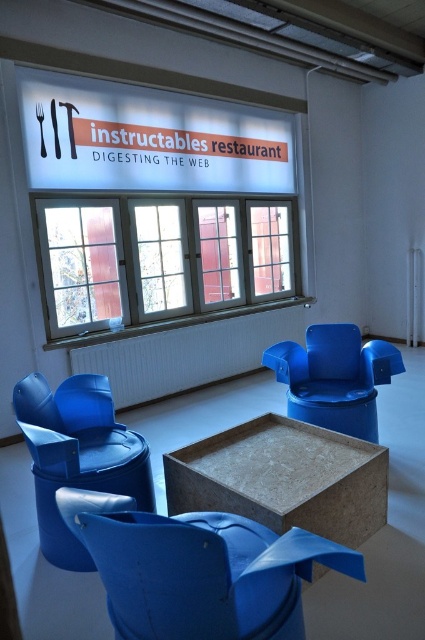
You are a guest at the Instructables Restaurant and need to sit down. There is a matte blue armchair at center and a brown cardboard table at center. Which object is wider?

The brown cardboard table at center is wider than the matte blue armchair at center.

You are a customer sitting in the matte blue armchair at center and want to reach the brown cardboard table at center to grab a menu. In which direction should you move?

The matte blue armchair at center is to the left of the brown cardboard table at center, so you should move to your right to reach it.

You are a guest at the Instructables Restaurant and want to sit down. Which object should you approach first, the matte blue armchair at center or the brown cardboard table at center?

The matte blue armchair at center is located above the brown cardboard table at center, so you should approach the brown cardboard table at center first as it is lower and likely closer to your current position.